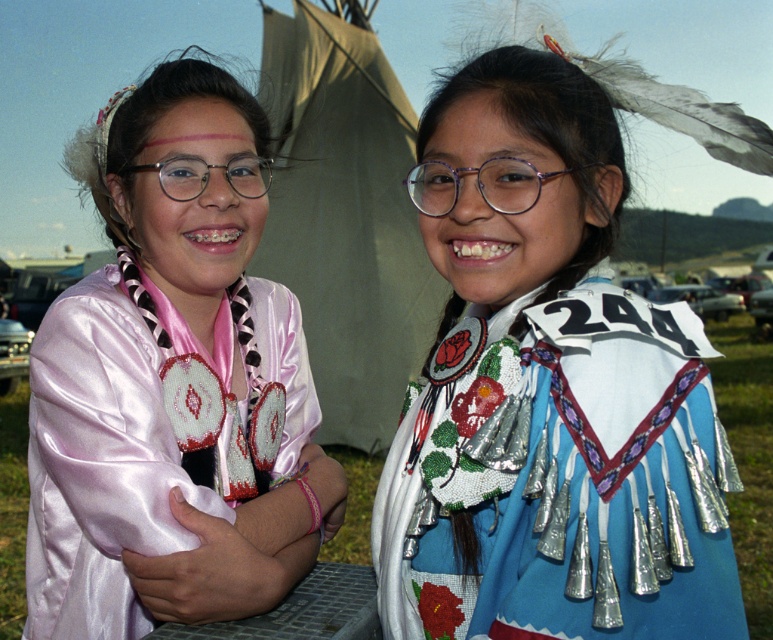
Question: Which point appears closest to the camera in this image?

Choices:
 (A) (380, 83)
 (B) (226, 426)

Answer: (B)

Question: Which point is farther from the camera taking this photo?

Choices:
 (A) (284, 458)
 (B) (363, 170)
 (C) (427, 474)

Answer: (B)

Question: Does blue beaded dress at center have a lesser width compared to satin pink blouse at left?

Choices:
 (A) yes
 (B) no

Answer: (A)

Question: Which point appears farthest from the camera in this image?

Choices:
 (A) (324, 186)
 (B) (513, 534)
 (C) (107, 429)

Answer: (A)

Question: Can you confirm if blue beaded dress at center is positioned below beige canvas tent at center?

Choices:
 (A) no
 (B) yes

Answer: (A)

Question: Is satin pink blouse at left bigger than beige canvas tent at center?

Choices:
 (A) yes
 (B) no

Answer: (A)